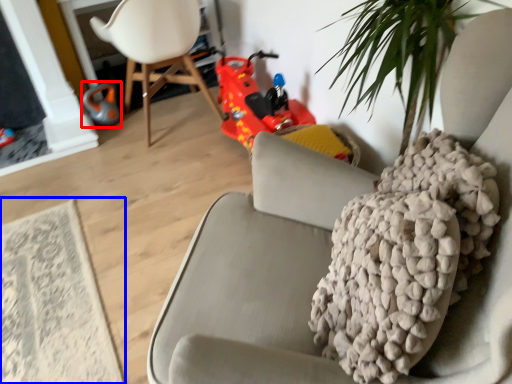
Question: Which point is closer to the camera, toy (highlighted by a red box) or mat (highlighted by a blue box)?

Choices:
 (A) toy
 (B) mat

Answer: (B)